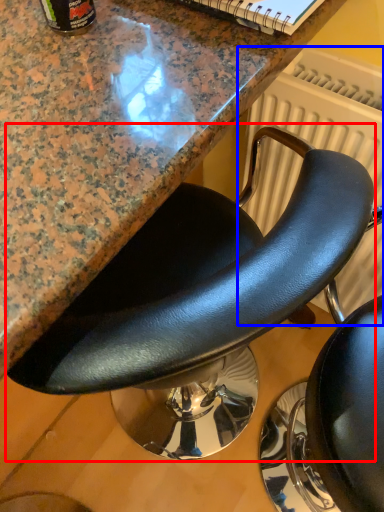
Question: Which object is further to the camera taking this photo, chair (highlighted by a red box) or radiator (highlighted by a blue box)?

Choices:
 (A) chair
 (B) radiator

Answer: (B)